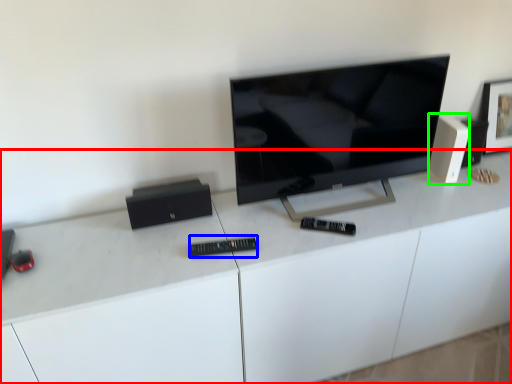
Question: Which object is the closest to the desk (highlighted by a red box)? Choose among these: control (highlighted by a blue box) or speaker (highlighted by a green box).

Choices:
 (A) control
 (B) speaker

Answer: (A)